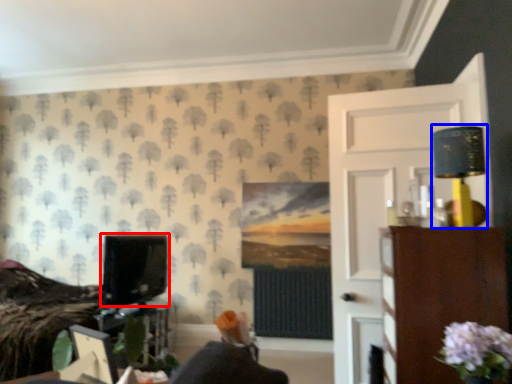
Question: Among these objects, which one is farthest to the camera, computer monitor (highlighted by a red box) or table lamp (highlighted by a blue box)?

Choices:
 (A) computer monitor
 (B) table lamp

Answer: (A)